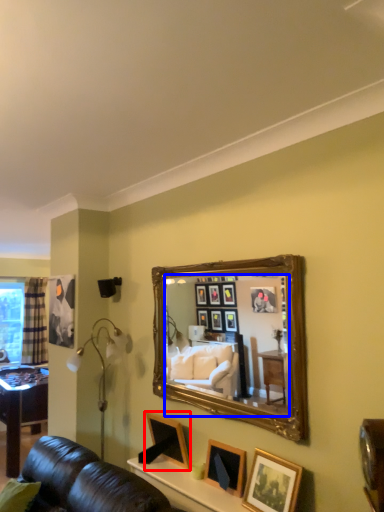
Question: Which object is further to the camera taking this photo, picture frame (highlighted by a red box) or mirror (highlighted by a blue box)?

Choices:
 (A) picture frame
 (B) mirror

Answer: (A)